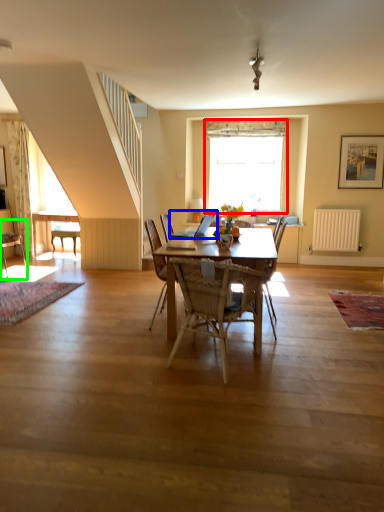
Question: Estimate the real-world distances between objects in this image. Which object is closer to window (highlighted by a red box), laptop (highlighted by a blue box) or chair (highlighted by a green box)?

Choices:
 (A) laptop
 (B) chair

Answer: (A)